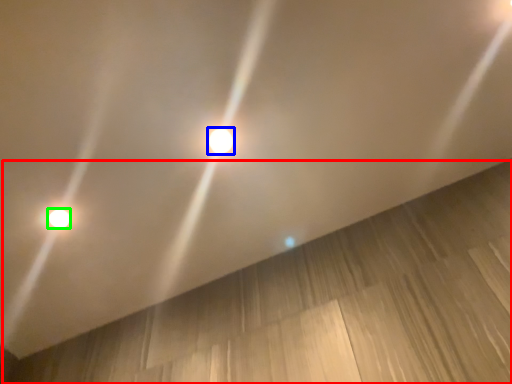
Question: Based on their relative distances, which object is farther from plywood (highlighted by a red box)? Choose from lamp (highlighted by a blue box) and lamp (highlighted by a green box).

Choices:
 (A) lamp
 (B) lamp

Answer: (B)